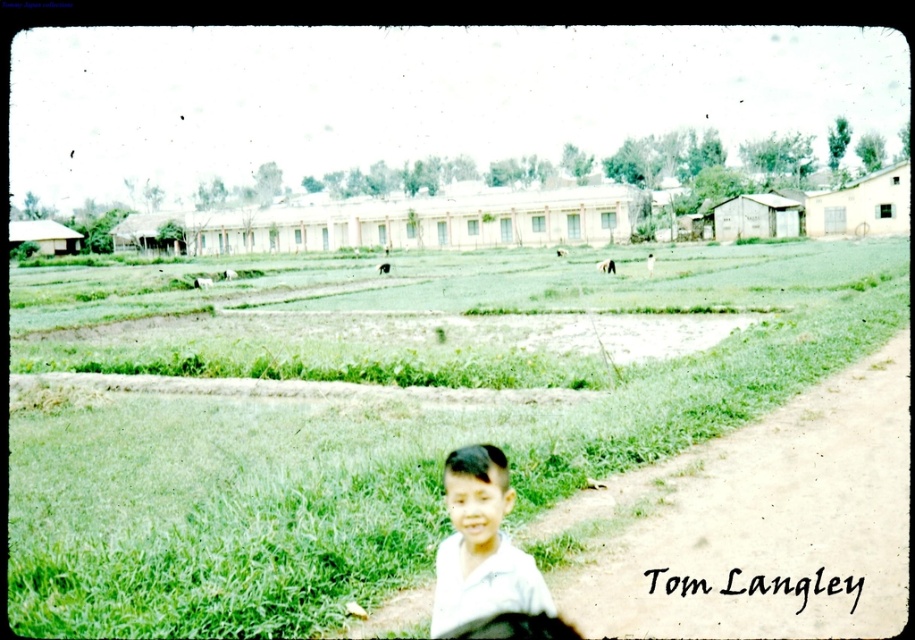
Does white cotton shirt at lower center have a greater width compared to light beige wood hut at right?

No.

Does white cotton shirt at lower center appear on the left side of light beige wood hut at right?

Correct, you'll find white cotton shirt at lower center to the left of light beige wood hut at right.

Does point (496, 548) come farther from viewer compared to point (841, 227)?

No, it is in front of (841, 227).

In order to click on white cotton shirt at lower center in this screenshot , I will do `click(481, 547)`.

In the scene shown: Between light beige wood hut at right and wooden hut at center-right, which one appears on the right side from the viewer's perspective?

light beige wood hut at right

Which is below, light beige wood hut at right or wooden hut at center-right?

wooden hut at center-right

What do you see at coordinates (862, 205) in the screenshot?
I see `light beige wood hut at right` at bounding box center [862, 205].

You are a GUI agent. You are given a task and a screenshot of the screen. Output one action in this format:
    pyautogui.click(x=<x>, y=<y>)
    Task: Click on the light beige wood hut at right
    
    Given the screenshot: What is the action you would take?
    pyautogui.click(x=862, y=205)

Which of these two, green grass at center or light beige wood hut at right, stands shorter?

green grass at center is shorter.

Between green grass at center and light beige wood hut at right, which one is positioned higher?

light beige wood hut at right

Locate an element on the screen. The width and height of the screenshot is (915, 640). green grass at center is located at coordinates (380, 417).